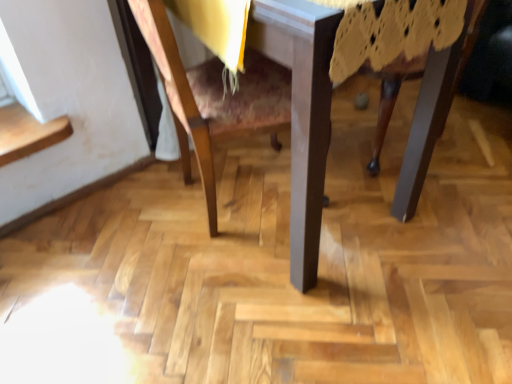
Question: Does point (172, 81) appear closer or farther from the camera than point (295, 39)?

Choices:
 (A) farther
 (B) closer

Answer: (A)

Question: Considering the positions of wooden chair at center and wooden table at center in the image, is wooden chair at center wider or thinner than wooden table at center?

Choices:
 (A) thin
 (B) wide

Answer: (A)

Question: Which is correct: wooden chair at center is inside wooden table at center, or outside of it?

Choices:
 (A) outside
 (B) inside

Answer: (B)

Question: Does point (298, 253) appear closer or farther from the camera than point (216, 91)?

Choices:
 (A) closer
 (B) farther

Answer: (A)

Question: Would you say wooden table at center is inside or outside wooden chair at center?

Choices:
 (A) inside
 (B) outside

Answer: (A)

Question: From their relative heights in the image, would you say wooden table at center is taller or shorter than wooden chair at center?

Choices:
 (A) tall
 (B) short

Answer: (A)

Question: In terms of size, does wooden table at center appear bigger or smaller than wooden chair at center?

Choices:
 (A) big
 (B) small

Answer: (A)